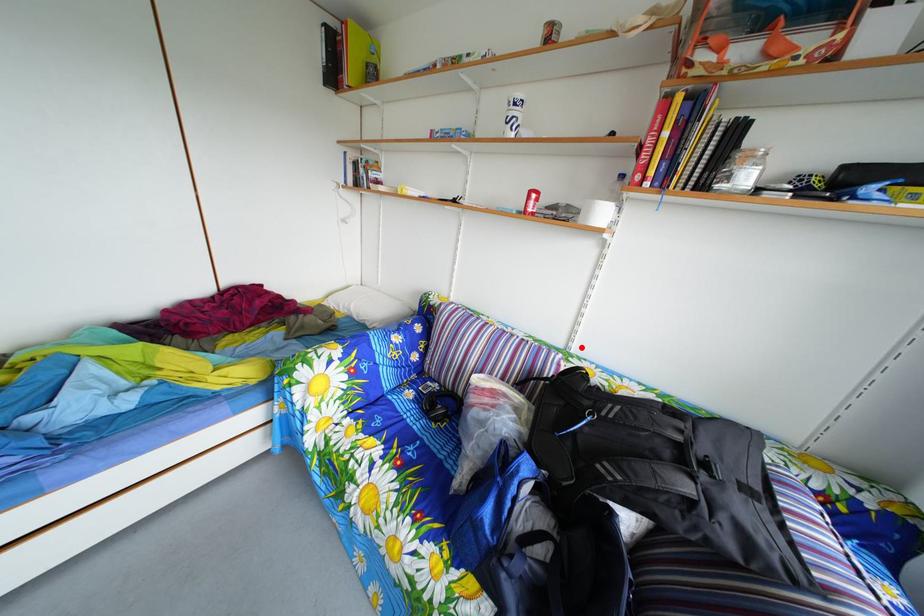
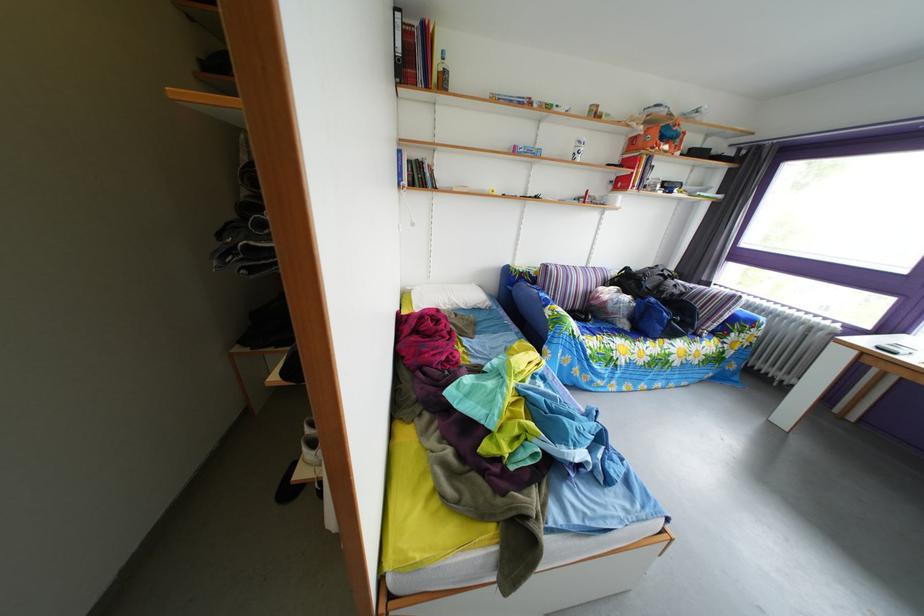
Question: I am providing you with two images of the same scene from different viewpoints. Image1 has a red point marked. In image2, the corresponding 3D location appears at what relative position? Reply with the corresponding letter.

Choices:
 (A) Closer
 (B) Farther

Answer: (B)